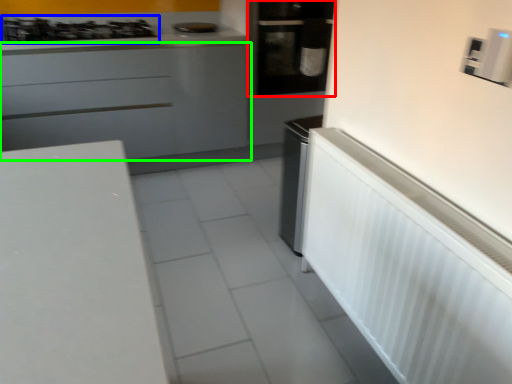
Question: Which object is positioned closest to home appliance (highlighted by a red box)? Select from gas stove (highlighted by a blue box) and cabinetry (highlighted by a green box).

Choices:
 (A) gas stove
 (B) cabinetry

Answer: (B)